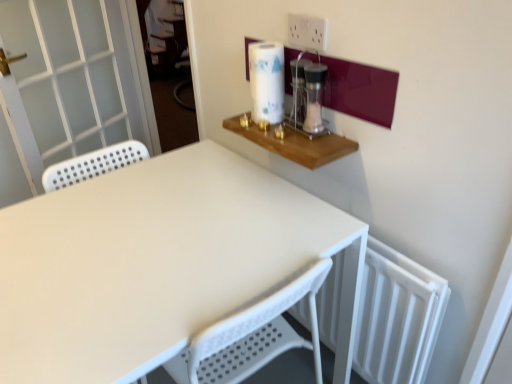
In order to click on vacant area situated to the left side of clear glass jar at upper right in this screenshot , I will do `click(274, 133)`.